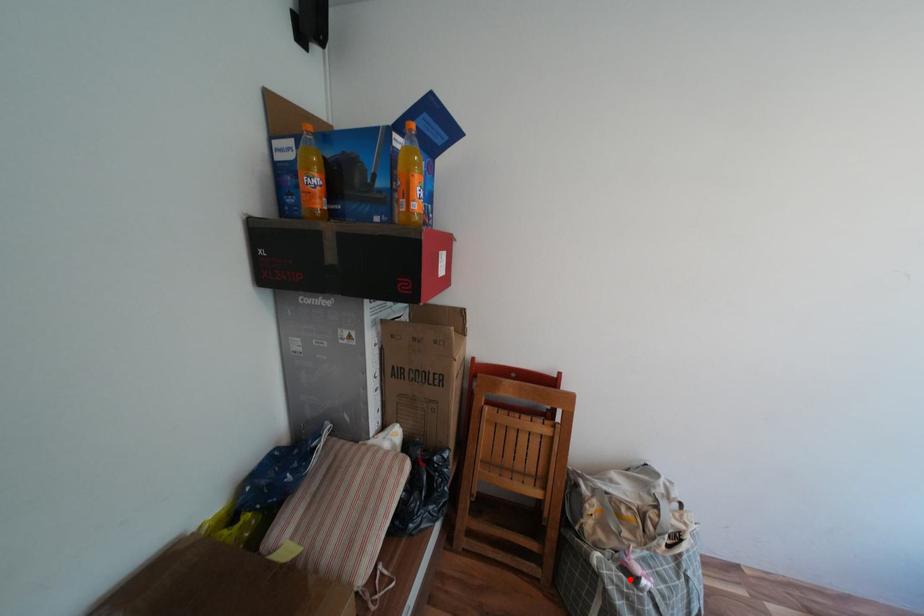
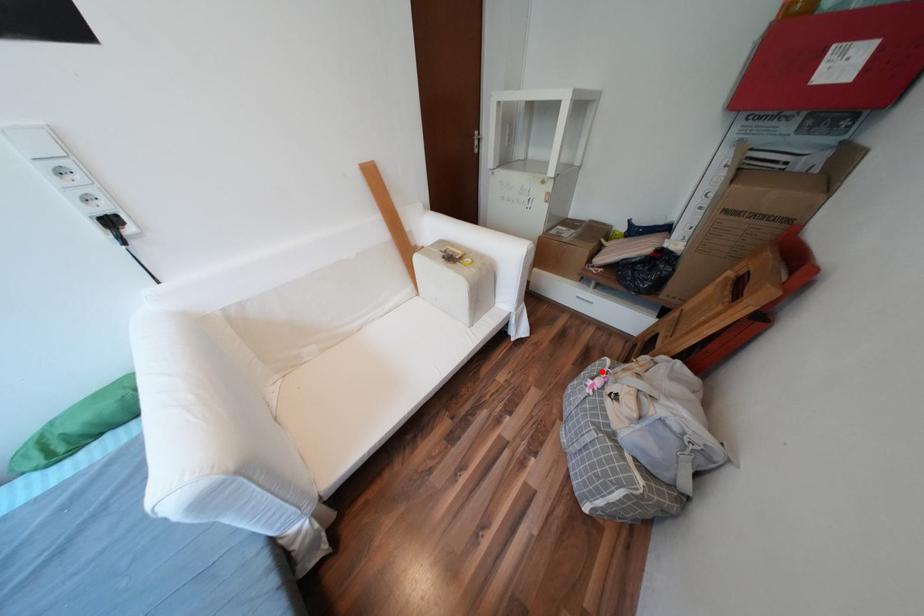
I am providing you with two images of the same scene from different viewpoints. A red point is marked on the first image and another point is marked on the second image. Do the highlighted points in image1 and image2 indicate the same real-world spot?

Yes